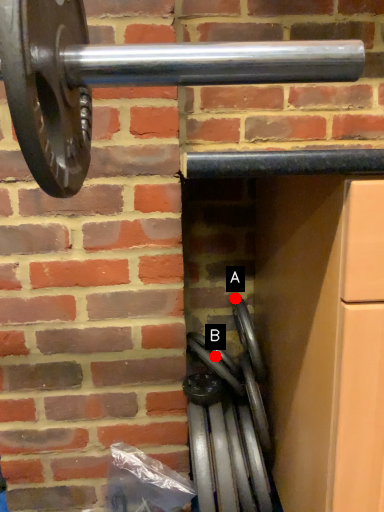
Question: Two points are circled on the image, labeled by A and B beside each circle. Which point is farther from the camera taking this photo?

Choices:
 (A) A is further
 (B) B is further

Answer: (A)